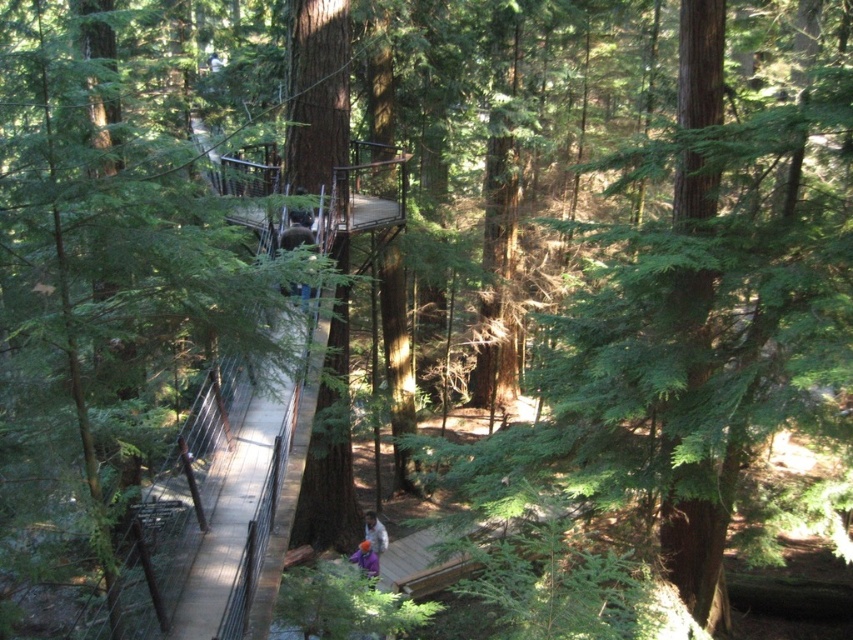
Is white cotton shirt at lower center taller than purple fabric at center?

Correct, white cotton shirt at lower center is much taller as purple fabric at center.

From the picture: Does white cotton shirt at lower center lie behind purple fabric at center?

That is True.

Where is `white cotton shirt at lower center`? Image resolution: width=853 pixels, height=640 pixels. white cotton shirt at lower center is located at coordinates (375, 532).